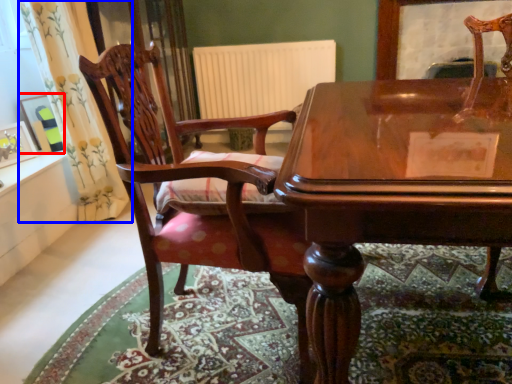
Question: Which object is further to the camera taking this photo, picture frame (highlighted by a red box) or curtain (highlighted by a blue box)?

Choices:
 (A) picture frame
 (B) curtain

Answer: (A)